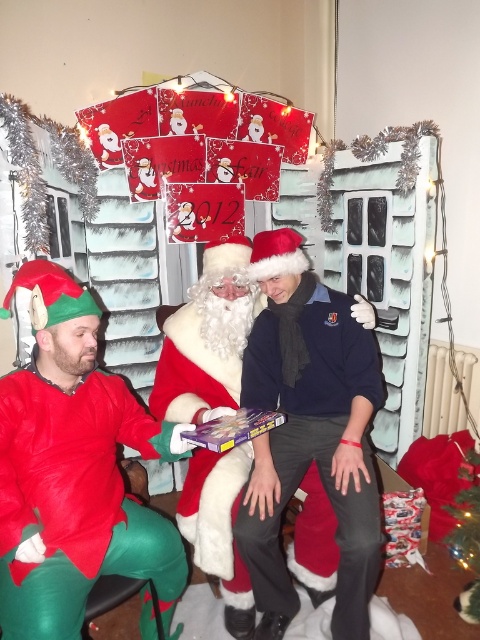
Question: Is velvet red elf costume at left positioned at the back of dark blue sweater at center?

Choices:
 (A) no
 (B) yes

Answer: (A)

Question: Does dark blue sweater at center have a larger size compared to white fluffy santa at center?

Choices:
 (A) no
 (B) yes

Answer: (A)

Question: Among these objects, which one is farthest from the camera?

Choices:
 (A) velvet red elf costume at left
 (B) matte red santa suit at center
 (C) dark blue sweater at center

Answer: (C)

Question: Which point appears closest to the camera in this image?

Choices:
 (A) (333, 570)
 (B) (237, 566)
 (C) (49, 362)

Answer: (C)

Question: Considering the real-world distances, which object is closest to the matte red santa suit at center?

Choices:
 (A) white fluffy santa at center
 (B) velvet red elf costume at left
 (C) dark blue sweater at center

Answer: (B)

Question: Can you confirm if velvet red elf costume at left is positioned below dark blue sweater at center?

Choices:
 (A) no
 (B) yes

Answer: (B)